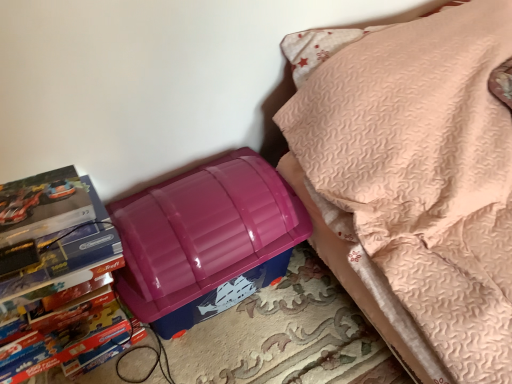
Question: Is point (399, 158) closer or farther from the camera than point (224, 226)?

Choices:
 (A) farther
 (B) closer

Answer: (B)

Question: In terms of width, does purple plastic storage bin at lower left look wider or thinner when compared to glossy plastic lunch box at lower left?

Choices:
 (A) thin
 (B) wide

Answer: (B)

Question: Based on their relative distances, which object is nearer to the purple plastic storage bin at lower left?

Choices:
 (A) glossy plastic lunch box at lower left
 (B) matte cardboard book at left

Answer: (A)

Question: Which object is positioned farthest from the purple plastic storage bin at lower left?

Choices:
 (A) glossy plastic lunch box at lower left
 (B) matte cardboard book at left

Answer: (B)